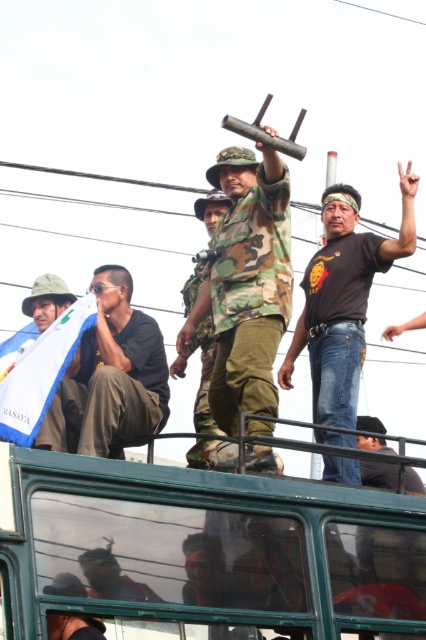
Is matte black shirt at left thinner than camouflage fabric uniform at center?

No.

Is point (118, 296) positioned before point (204, 200)?

Yes, point (118, 296) is closer to viewer.

This screenshot has height=640, width=426. In order to click on matte black shirt at left in this screenshot , I will do `click(109, 378)`.

How distant is black matte t-shirt at upper center from camouflage fabric uniform at center?

black matte t-shirt at upper center is 4.73 meters away from camouflage fabric uniform at center.

Describe the element at coordinates (344, 300) in the screenshot. The image size is (426, 640). I see `black matte t-shirt at upper center` at that location.

The height and width of the screenshot is (640, 426). Identify the location of black matte t-shirt at upper center. click(x=344, y=300).

I want to click on matte black shirt at left, so click(109, 378).

The width and height of the screenshot is (426, 640). What do you see at coordinates (109, 378) in the screenshot?
I see `matte black shirt at left` at bounding box center [109, 378].

Is point (117, 374) positioned in front of point (13, 387)?

No.

Identify the location of matte black shirt at left. This screenshot has height=640, width=426. (x=109, y=378).